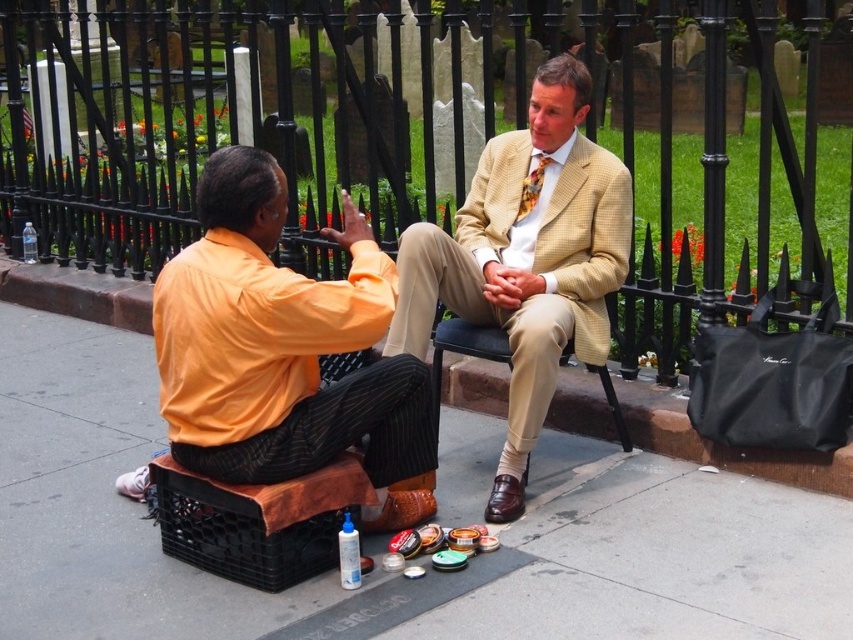
You are a photographer planning to take a portrait of the two men sitting on the bench. You want to ensure that both the black wrought iron fence at upper center and the floral silk tie at center are visible in the frame. However, you are concerned about the width of these elements affecting the composition. Which object should you focus on to avoid it being too narrow in the photo?

The black wrought iron fence at upper center has a lesser width compared to the floral silk tie at center, so you should focus on the black wrought iron fence at upper center to avoid it being too narrow in the photo.